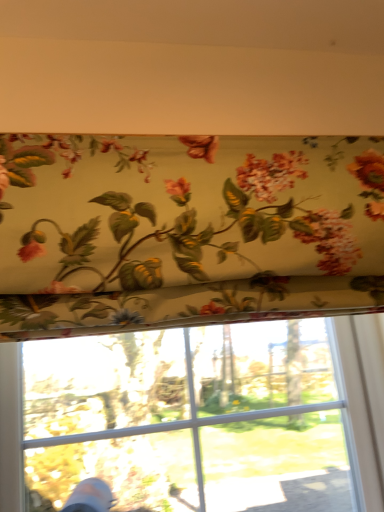
Question: In terms of width, does floral fabric at upper center look wider or thinner when compared to floral fabric at upper center?

Choices:
 (A) thin
 (B) wide

Answer: (A)

Question: From the image's perspective, is floral fabric at upper center located above or below floral fabric at upper center?

Choices:
 (A) below
 (B) above

Answer: (B)

Question: Is floral fabric at upper center taller or shorter than floral fabric at upper center?

Choices:
 (A) short
 (B) tall

Answer: (A)

Question: From their relative heights in the image, would you say floral fabric at upper center is taller or shorter than floral fabric at upper center?

Choices:
 (A) tall
 (B) short

Answer: (A)

Question: Considering the relative positions of floral fabric at upper center and floral fabric at upper center in the image provided, is floral fabric at upper center to the left or to the right of floral fabric at upper center?

Choices:
 (A) right
 (B) left

Answer: (B)

Question: In terms of width, does floral fabric at upper center look wider or thinner when compared to floral fabric at upper center?

Choices:
 (A) wide
 (B) thin

Answer: (A)

Question: Is point (337, 334) positioned closer to the camera than point (319, 239)?

Choices:
 (A) closer
 (B) farther

Answer: (B)